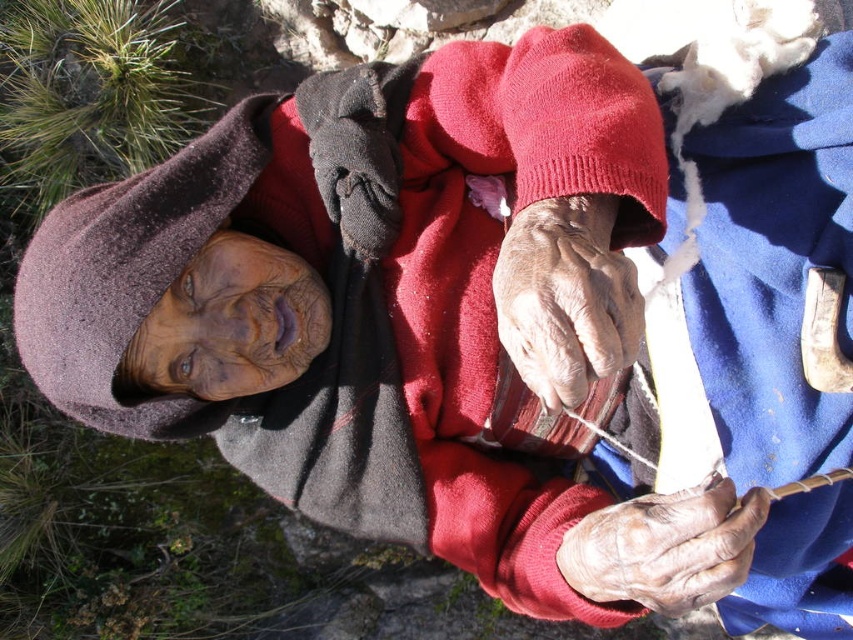
Does dry skin at center have a greater width compared to dry skin at lower right?

In fact, dry skin at center might be narrower than dry skin at lower right.

Consider the image. Is dry skin at center in front of dry skin at lower right?

Yes, dry skin at center is closer to the viewer.

Locate an element on the screen. dry skin at center is located at coordinates (566, 298).